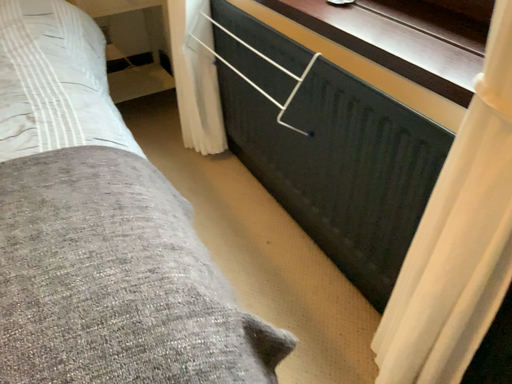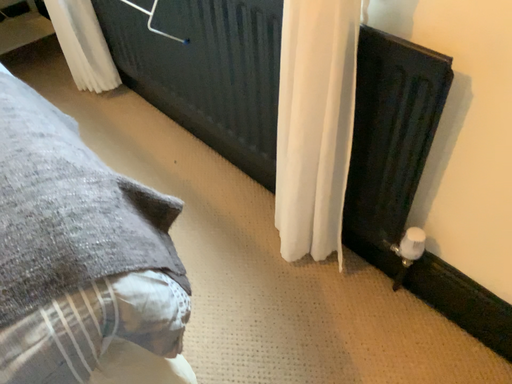
Question: Which way did the camera rotate in the video?

Choices:
 (A) rotated left
 (B) rotated right

Answer: (B)